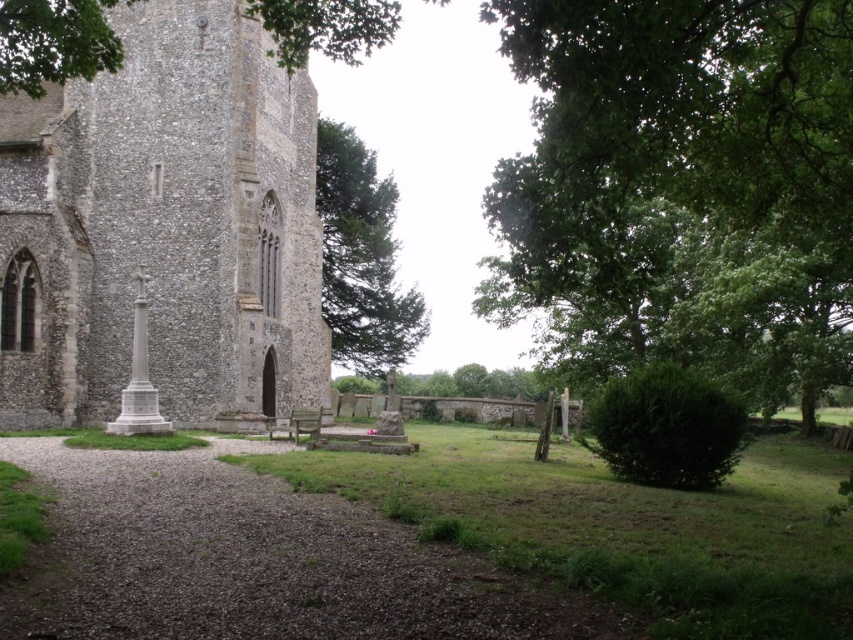
Question: Which point is farther from the camera taking this photo?

Choices:
 (A) (746, 145)
 (B) (309, 433)
 (C) (270, 6)
 (D) (410, 301)

Answer: (D)

Question: Can you confirm if green leafy tree at right is positioned below green leafy tree at upper left?

Choices:
 (A) yes
 (B) no

Answer: (A)

Question: Based on their relative distances, which object is farther from the green leafy tree at upper left?

Choices:
 (A) wooden park bench at center
 (B) green leafy tree at center
 (C) stone church at left
 (D) green leafy tree at right

Answer: (B)

Question: From the image, what is the correct spatial relationship of green leafy tree at upper left in relation to wooden park bench at center?

Choices:
 (A) left
 (B) right

Answer: (A)

Question: Which of these objects is positioned closest to the green leafy tree at upper left?

Choices:
 (A) green leafy tree at center
 (B) green leafy tree at right

Answer: (B)

Question: Is green leafy tree at right to the right of green leafy tree at center from the viewer's perspective?

Choices:
 (A) yes
 (B) no

Answer: (A)